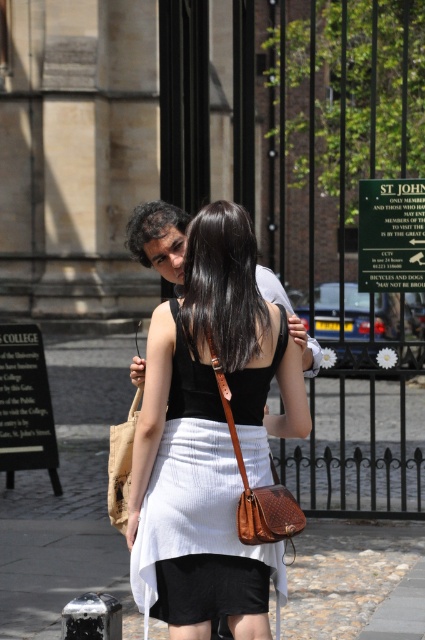
Who is lower down, matte brown purse at center or black cotton shorts at lower center?

black cotton shorts at lower center is lower down.

Is point (215, 323) farther from viewer compared to point (209, 573)?

No, (215, 323) is closer to viewer.

The height and width of the screenshot is (640, 425). Find the location of `matte brown purse at center`. matte brown purse at center is located at coordinates (217, 344).

This screenshot has height=640, width=425. I want to click on matte brown purse at center, so click(217, 344).

Who is higher up, black cotton shorts at lower center or brown leather shoulder bag at center?

brown leather shoulder bag at center is above.

Can you confirm if black cotton shorts at lower center is shorter than brown leather shoulder bag at center?

Yes.

Locate an element on the screen. black cotton shorts at lower center is located at coordinates 209,589.

Can you confirm if black matte dress at center is thinner than brown leather shoulder bag at center?

Correct, black matte dress at center's width is less than brown leather shoulder bag at center's.

Does point (291, 321) lie behind point (207, 340)?

Yes.

What do you see at coordinates (159, 237) in the screenshot? This screenshot has height=640, width=425. I see `black matte dress at center` at bounding box center [159, 237].

What are the coordinates of `black matte dress at center` in the screenshot? It's located at (159, 237).